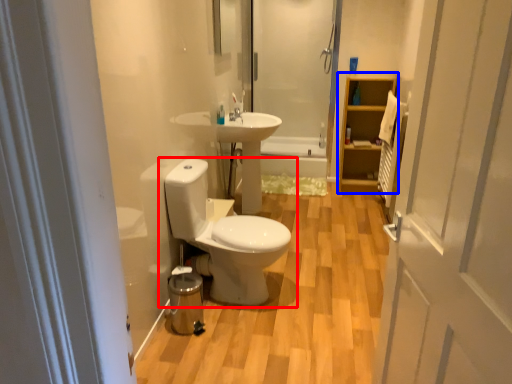
Question: Which of the following is the farthest to the observer, toilet (highlighted by a red box) or cabinet (highlighted by a blue box)?

Choices:
 (A) toilet
 (B) cabinet

Answer: (B)